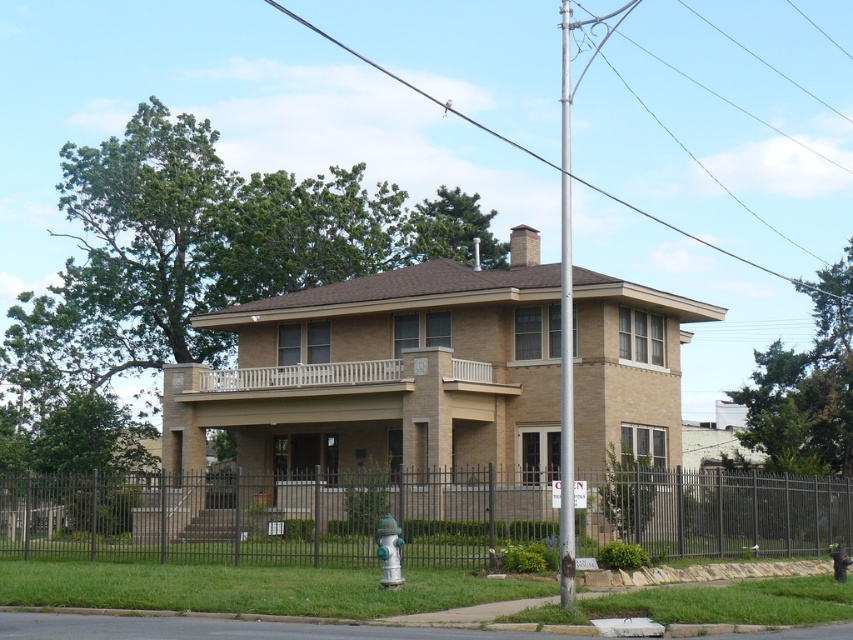
Question: Is white wood railing at upper center positioned at the back of metallic wire at upper center?

Choices:
 (A) yes
 (B) no

Answer: (B)

Question: Among these objects, which one is farthest from the camera?

Choices:
 (A) white painted wood pole at center
 (B) white wood railing at upper center
 (C) green metallic hydrant at lower center
 (D) black metal fence at lower center

Answer: (B)

Question: Which point is farther to the camera?

Choices:
 (A) coord(212,504)
 (B) coord(390,550)
 (C) coord(357,362)

Answer: (C)

Question: Which of these objects is positioned closest to the white wood railing at upper center?

Choices:
 (A) metallic wire at upper center
 (B) green metallic hydrant at lower center

Answer: (B)

Question: Considering the relative positions of white wood railing at upper center and white painted wood pole at center in the image provided, where is white wood railing at upper center located with respect to white painted wood pole at center?

Choices:
 (A) below
 (B) above

Answer: (A)

Question: Where is black metal fence at lower center located in relation to white painted wood pole at center in the image?

Choices:
 (A) above
 (B) below

Answer: (B)